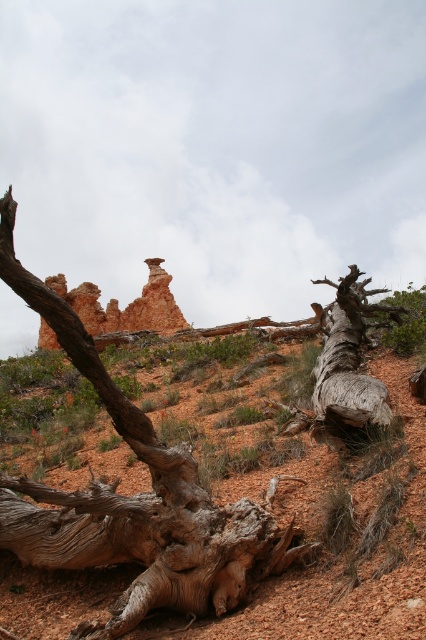
Question: Where is gray textured log at center located in relation to rustic sandstone hoodoo at center in the image?

Choices:
 (A) left
 (B) right

Answer: (B)

Question: Based on their relative distances, which object is farther from the gray weathered log at lower right?

Choices:
 (A) gray textured log at center
 (B) rustic sandstone hoodoo at center

Answer: (B)

Question: Among these points, which one is farthest from the camera?

Choices:
 (A) (359, 289)
 (B) (261, 544)
 (C) (103, 316)

Answer: (C)

Question: Is the position of gray textured log at center more distant than that of gray weathered log at lower right?

Choices:
 (A) yes
 (B) no

Answer: (B)

Question: Does gray textured log at center appear under rustic sandstone hoodoo at center?

Choices:
 (A) no
 (B) yes

Answer: (B)

Question: Which of the following is the farthest from the observer?

Choices:
 (A) gray weathered log at lower right
 (B) rustic sandstone hoodoo at center

Answer: (B)